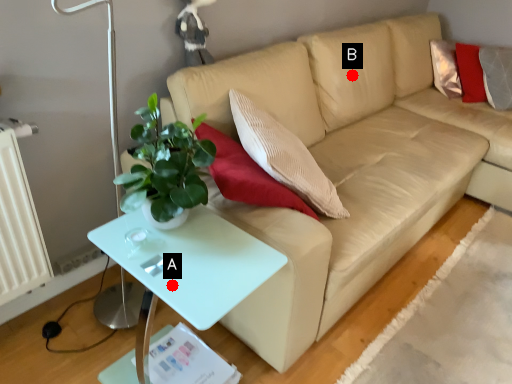
Question: Two points are circled on the image, labeled by A and B beside each circle. Among these points, which one is nearest to the camera?

Choices:
 (A) A is closer
 (B) B is closer

Answer: (A)